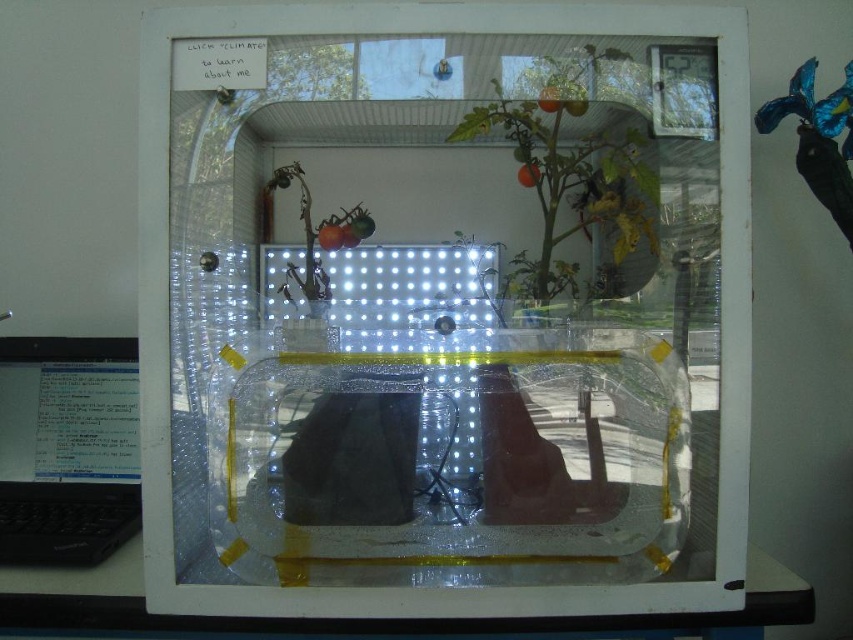
Can you confirm if transparent plastic window at center is positioned to the right of green matte plant at center?

Incorrect, transparent plastic window at center is not on the right side of green matte plant at center.

Which is behind, point (341, 548) or point (601, 218)?

The point (601, 218) is more distant.

Find the location of `transparent plastic window at center`. transparent plastic window at center is located at coordinates (444, 314).

Does transparent plastic window at center have a lesser width compared to black plastic laptop at lower left?

Incorrect, transparent plastic window at center's width is not less than black plastic laptop at lower left's.

Which of these two, transparent plastic window at center or black plastic laptop at lower left, stands shorter?

black plastic laptop at lower left

Does point (444, 211) come farther from viewer compared to point (131, 390)?

Yes, it is behind point (131, 390).

Where is `transparent plastic window at center`? The height and width of the screenshot is (640, 853). transparent plastic window at center is located at coordinates (444, 314).

Which is more to the left, black plastic laptop at lower left or green matte plant at center?

Positioned to the left is black plastic laptop at lower left.

Which is above, black plastic laptop at lower left or green matte plant at center?

green matte plant at center is higher up.

You are a GUI agent. You are given a task and a screenshot of the screen. Output one action in this format:
    pyautogui.click(x=<x>, y=<y>)
    Task: Click on the black plastic laptop at lower left
    Image resolution: width=853 pixels, height=640 pixels.
    Given the screenshot: What is the action you would take?
    pyautogui.click(x=67, y=449)